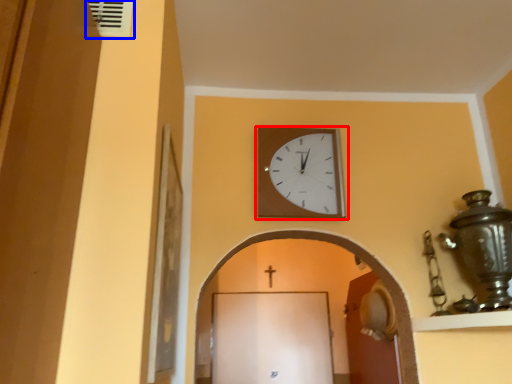
Question: Which of the following is the closest to the observer, wall clock (highlighted by a red box) or air conditioning (highlighted by a blue box)?

Choices:
 (A) wall clock
 (B) air conditioning

Answer: (B)